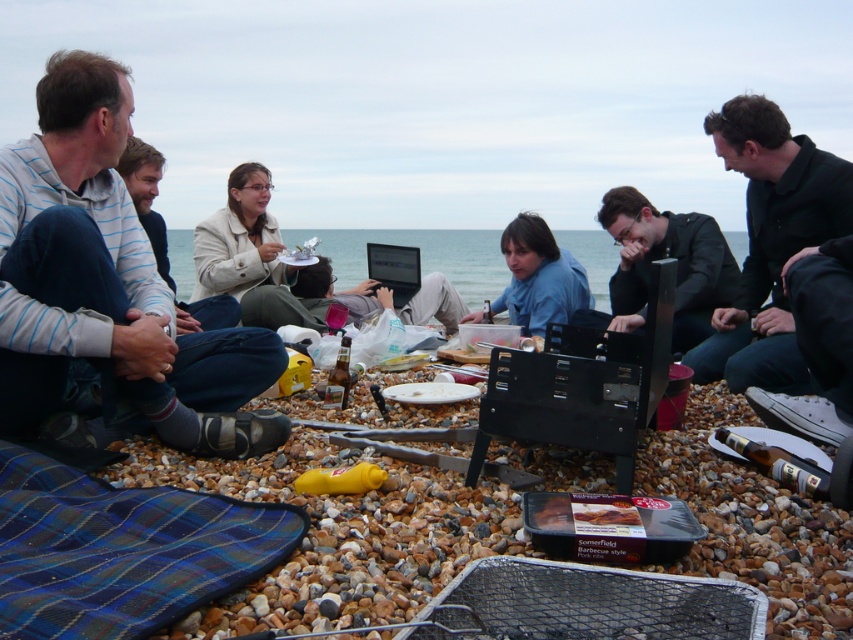
Consider the image. You are organizing a picnic and need to decide which jacket to use as a makeshift pillow. The black matte jacket at center and the light beige jacket at center are both available. Which jacket would provide more cushioning due to its larger size?

The black matte jacket at center has a greater width than the light beige jacket at center, so it would provide more cushioning as a makeshift pillow.

You are standing at the edge of the pebble beach looking towards the group. Where is the black matte jacket at center relative to your position?

The black matte jacket at center is located at point 0.405 on the horizontal axis and 0.775 on the vertical axis relative to your position.

You are organizing a group photo and need to arrange the light blue striped shirt at left and the black matte jacket at right so that both can be seen clearly. Given their sizes, which one should be placed closer to the camera to ensure both are visible without overlapping?

The light blue striped shirt at left is wider than the black matte jacket at right, so placing the light blue striped shirt at left closer to the camera will allow both to be visible without overlapping.